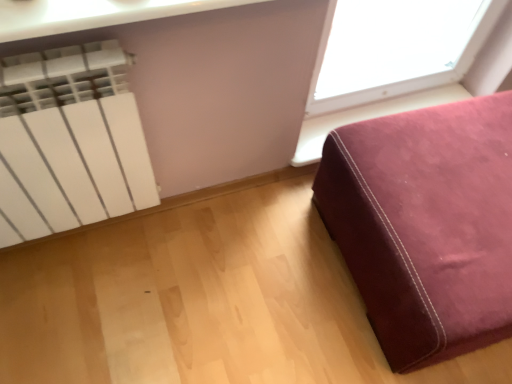
Question: Considering the positions of velvet-like burgundy ottoman at lower right and white matte radiator at upper left in the image, is velvet-like burgundy ottoman at lower right taller or shorter than white matte radiator at upper left?

Choices:
 (A) short
 (B) tall

Answer: (A)

Question: Is velvet-like burgundy ottoman at lower right inside or outside of white matte radiator at upper left?

Choices:
 (A) inside
 (B) outside

Answer: (B)

Question: Is velvet-like burgundy ottoman at lower right in front of or behind white matte radiator at upper left in the image?

Choices:
 (A) behind
 (B) front

Answer: (A)

Question: From the image's perspective, is white matte radiator at upper left above or below velvet-like burgundy ottoman at lower right?

Choices:
 (A) below
 (B) above

Answer: (B)

Question: Is point (129, 110) closer or farther from the camera than point (380, 329)?

Choices:
 (A) farther
 (B) closer

Answer: (B)

Question: Is white matte radiator at upper left taller or shorter than velvet-like burgundy ottoman at lower right?

Choices:
 (A) tall
 (B) short

Answer: (A)

Question: Considering the positions of white matte radiator at upper left and velvet-like burgundy ottoman at lower right in the image, is white matte radiator at upper left bigger or smaller than velvet-like burgundy ottoman at lower right?

Choices:
 (A) big
 (B) small

Answer: (B)